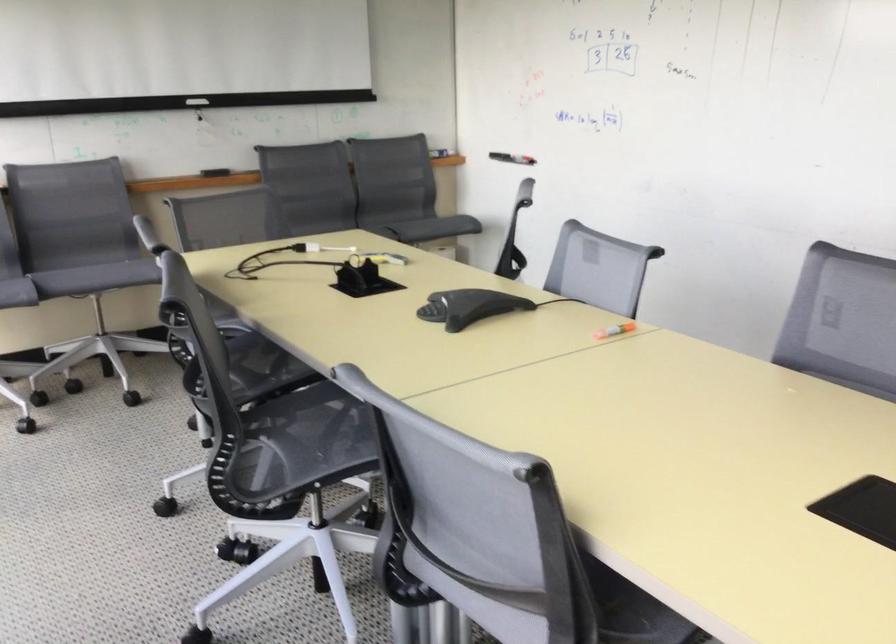
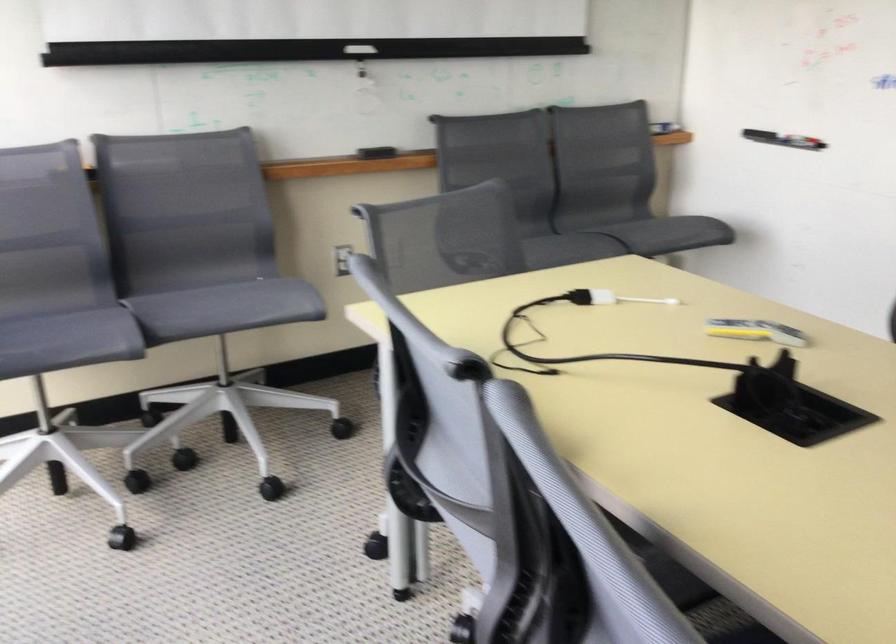
Which direction would the cameraman need to move to produce the second image?

The cameraman moved toward left, forward.